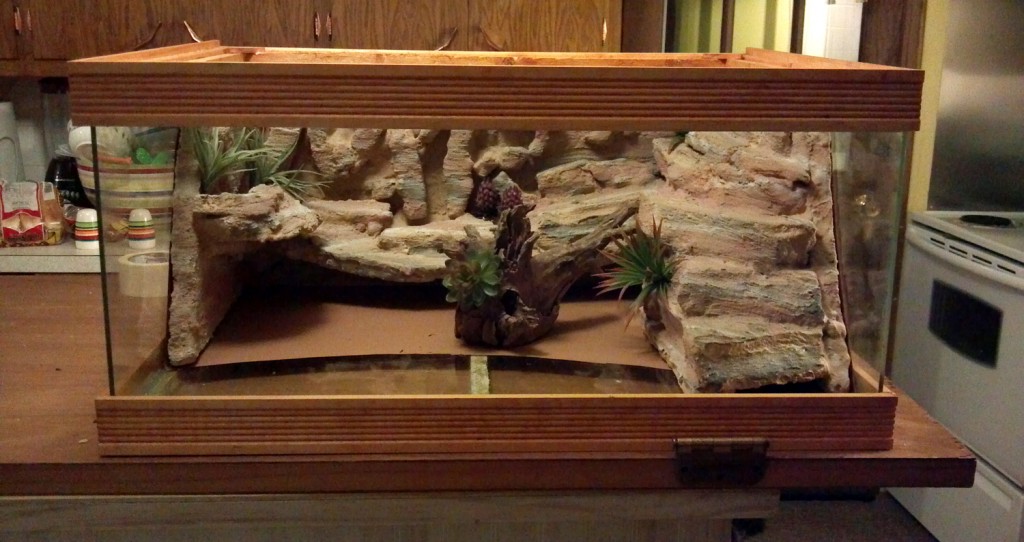
Locate an element on the screen. salt and pepper shakers is located at coordinates (79, 220), (141, 225).